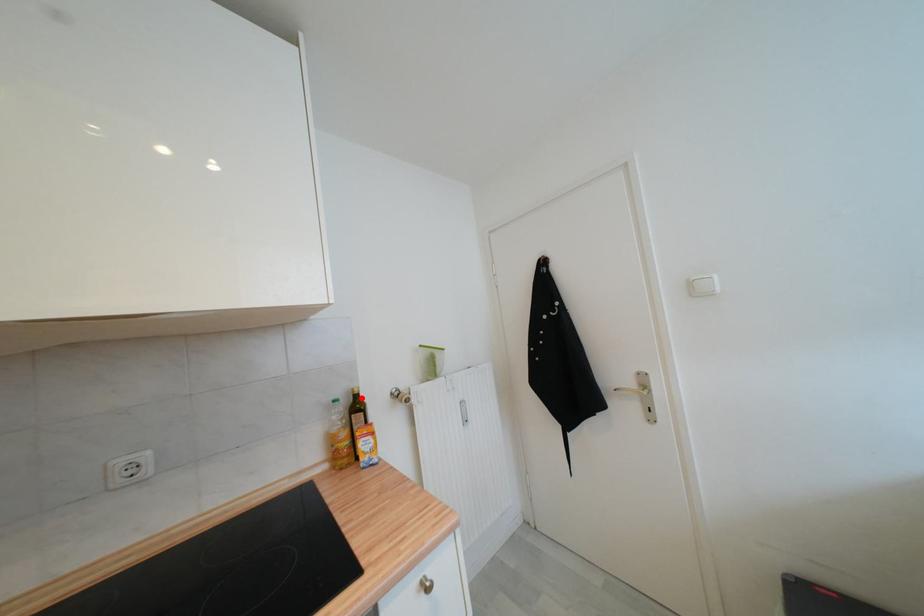
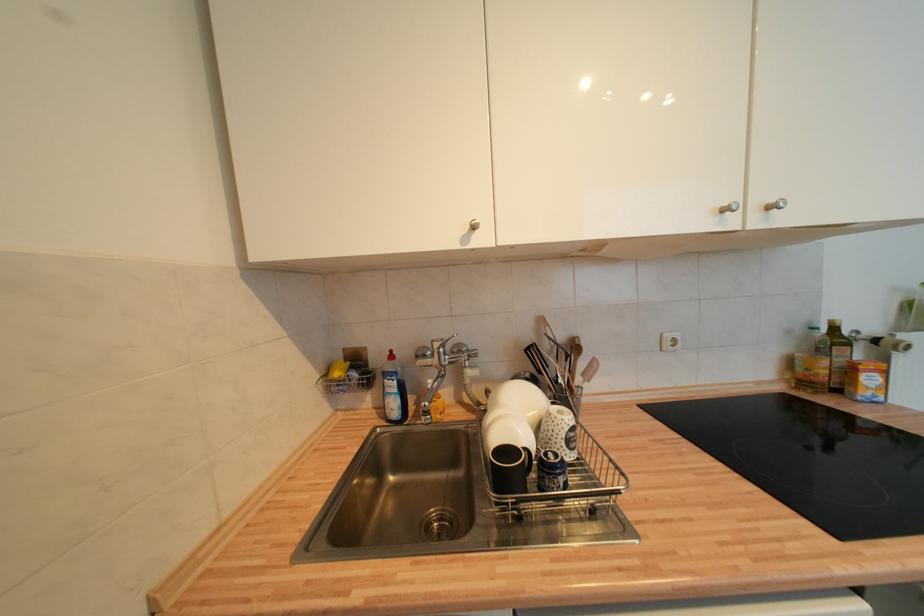
Locate, in the second image, the point that corresponds to the highlighted location in the first image.

(840, 331)